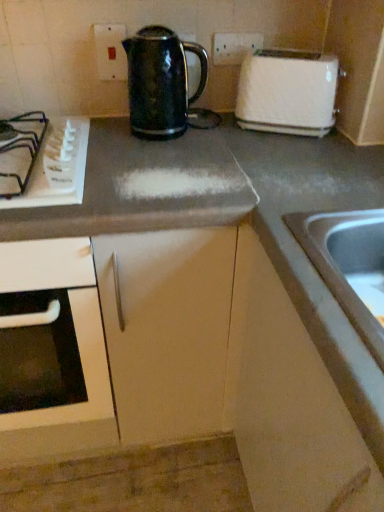
The width and height of the screenshot is (384, 512). I want to click on vacant area on top of matte gray cabinet at center, placed as the 1th cabinetry when sorted from left to right (from a real-world perspective), so click(162, 157).